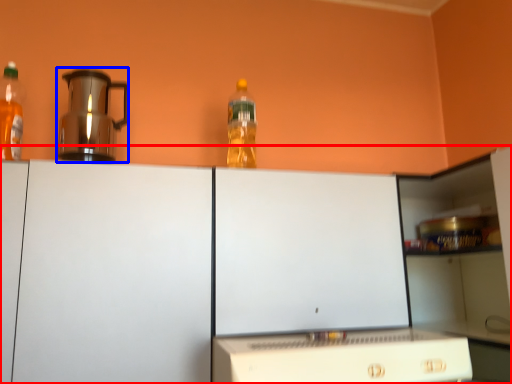
Question: Which object is closer to the camera taking this photo, cabinetry (highlighted by a red box) or kitchen appliance (highlighted by a blue box)?

Choices:
 (A) cabinetry
 (B) kitchen appliance

Answer: (A)